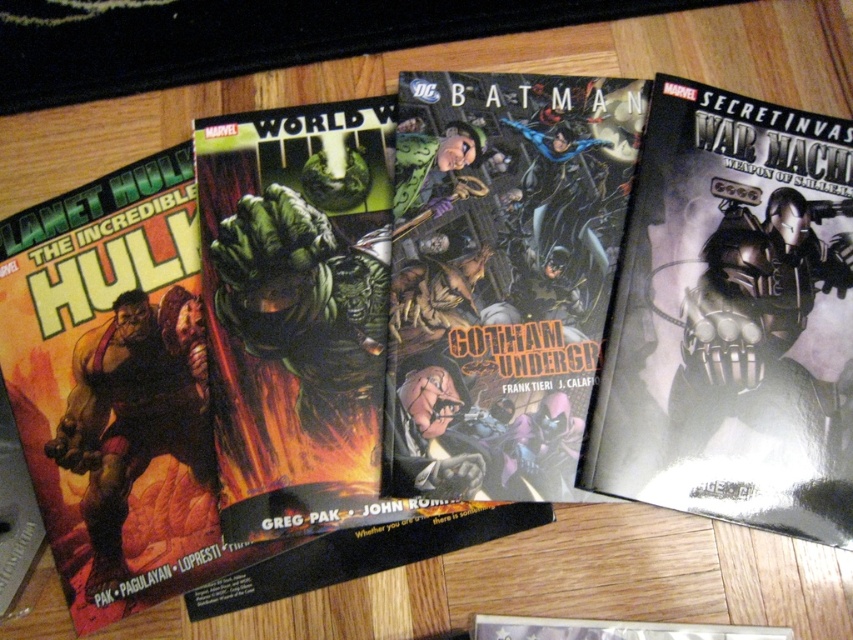
You are a delivery drone that needs to place a package between the metallic silver robot at right and the rubberized green hulk at left. The package requires 20 inches of space. Can you fit it between them?

The metallic silver robot at right and rubberized green hulk at left are 19.61 inches apart, which is less than the required 20 inches. Therefore, the package cannot be placed between them.

You are a photographer adjusting your camera to focus on two points on the comic covers. The first point is at coordinates point (619, 470) and the second point is at coordinates point (161, 298). Which point should you focus on first if you want to capture the closest one to the camera?

Point (619, 470) is closer to the viewer than point (161, 298), so you should focus on point (619, 470) first.

Based on the provided scene description, where exactly is the metallic silver robot at right located?

The metallic silver robot at right is located at point (730, 320).